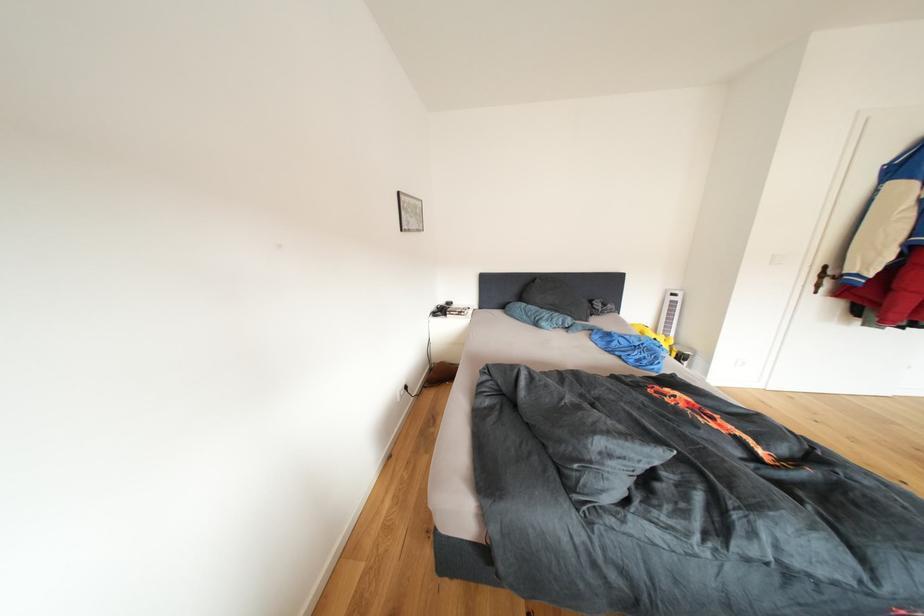
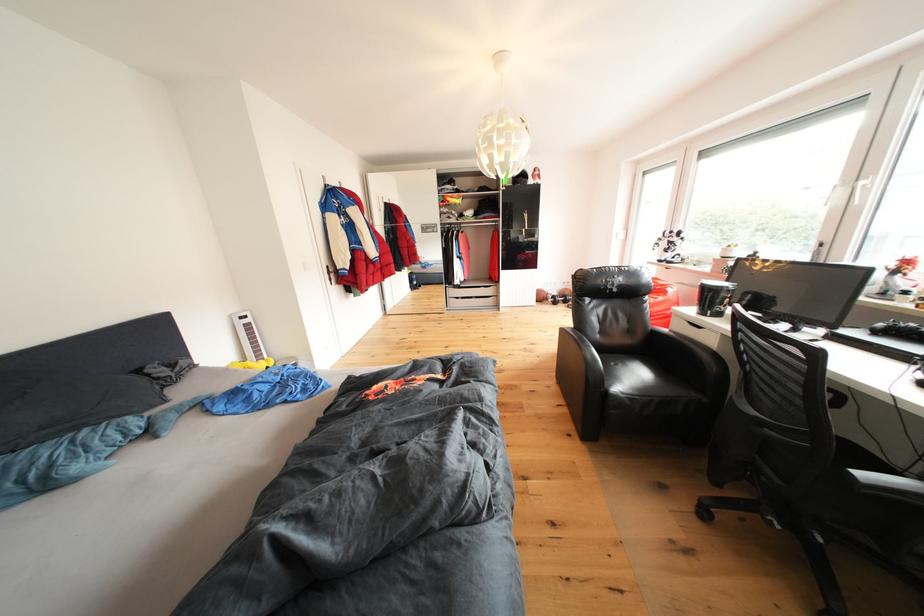
The images are taken continuously from a first-person perspective. In which direction is your viewpoint rotating?

The camera rotated toward right-down.